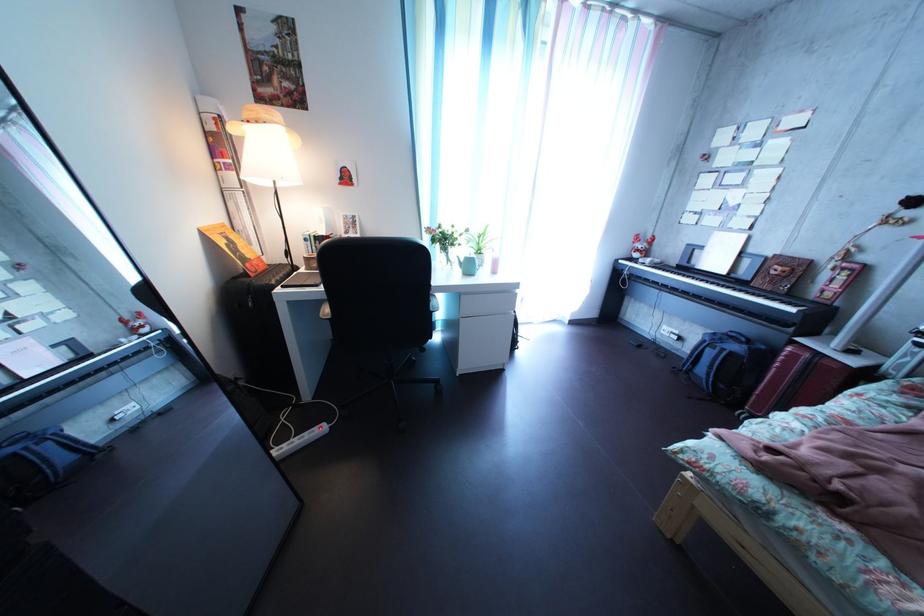
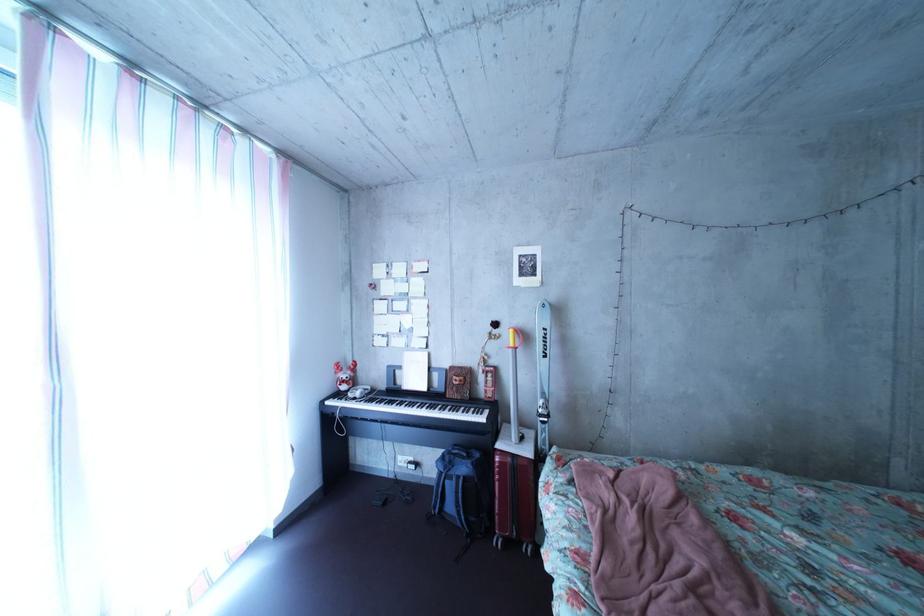
Where in the second image is the point corresponding to point 702,285 from the first image?

(416, 411)